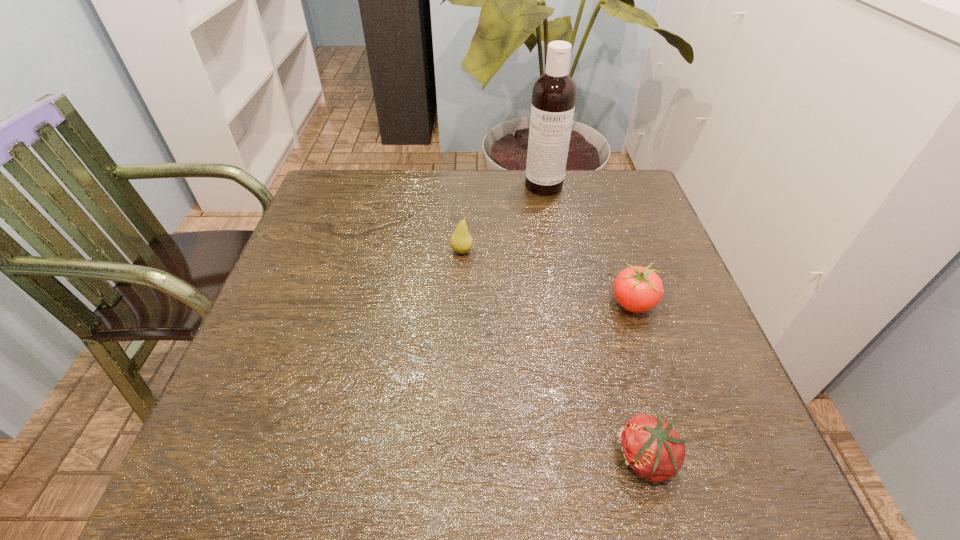
Image resolution: width=960 pixels, height=540 pixels. I want to click on vacant area that lies between the taller tomato and the third nearest object, so click(546, 278).

Identify the location of free space between the dishwasher detergent and the nearer tomato. (595, 322).

Identify the location of object that is the second closest one to the nearer tomato. (461, 241).

Identify the location of object that can be found as the second closest to the nearer tomato. (461, 241).

Identify the location of vacant space that satisfies the following two spatial constraints: 1. on the front side of the second farthest object; 2. on the left side of the nearer tomato. (452, 459).

Locate an element on the screen. The width and height of the screenshot is (960, 540). vacant space that satisfies the following two spatial constraints: 1. on the front side of the shortest object; 2. on the left side of the leftmost object is located at coordinates (452, 459).

You are a GUI agent. You are given a task and a screenshot of the screen. Output one action in this format:
    pyautogui.click(x=<x>, y=<y>)
    Task: Click on the vacant space that satisfies the following two spatial constraints: 1. on the front side of the leftmost object; 2. on the left side of the nearer tomato
    The width and height of the screenshot is (960, 540).
    Given the screenshot: What is the action you would take?
    pyautogui.click(x=452, y=459)

Identify the location of vacant region that satisfies the following two spatial constraints: 1. on the label side of the tallest object; 2. on the right side of the third farthest object. Image resolution: width=960 pixels, height=540 pixels. (565, 303).

You are a GUI agent. You are given a task and a screenshot of the screen. Output one action in this format:
    pyautogui.click(x=<x>, y=<y>)
    Task: Click on the vacant space that satisfies the following two spatial constraints: 1. on the label side of the farthest object; 2. on the left side of the shortest object
    
    Given the screenshot: What is the action you would take?
    pyautogui.click(x=593, y=459)

I want to click on vacant position in the image that satisfies the following two spatial constraints: 1. on the label side of the shortest object; 2. on the left side of the farthest object, so pyautogui.click(x=593, y=459).